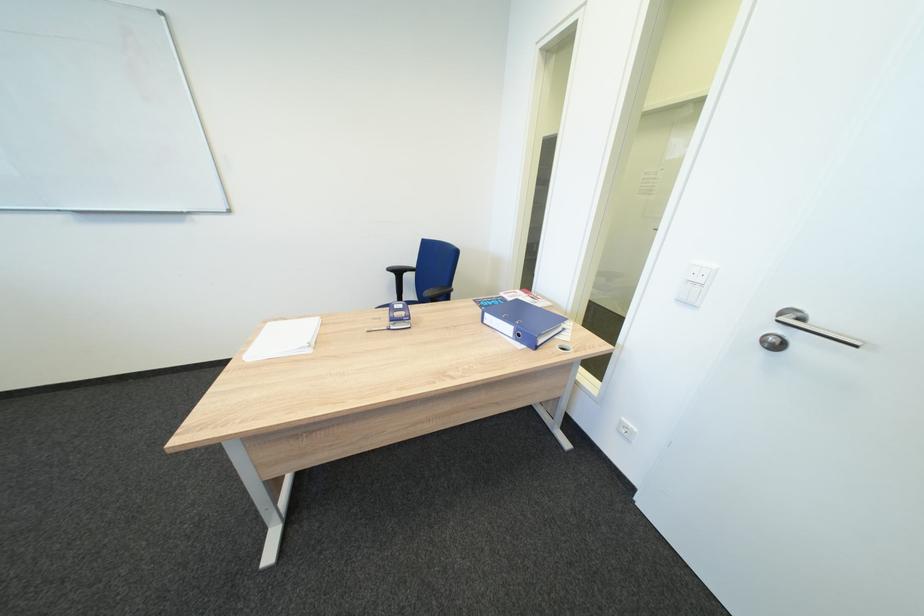
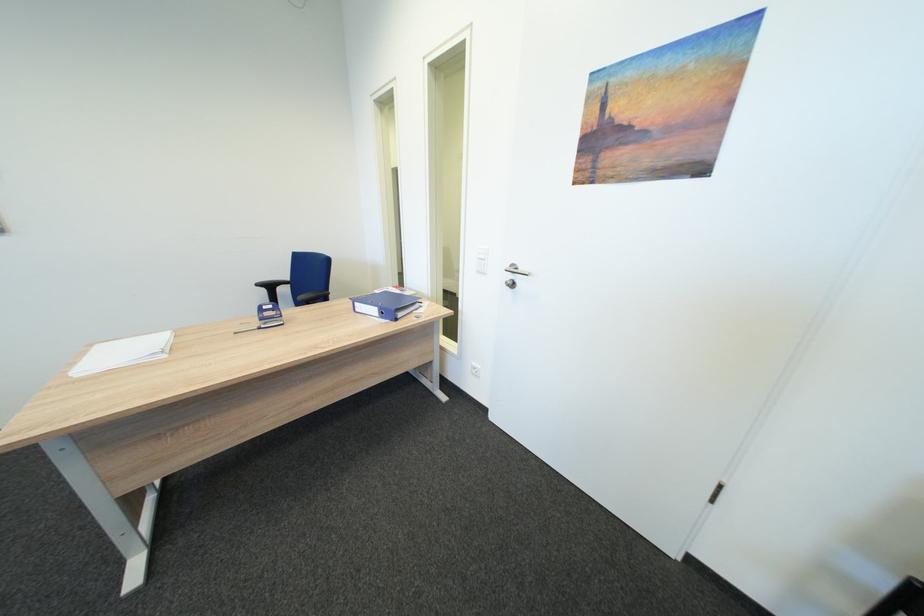
Question: The images are taken continuously from a first-person perspective. In which direction is your viewpoint rotating?

Choices:
 (A) Left
 (B) Right
 (C) Up
 (D) Down

Answer: (B)